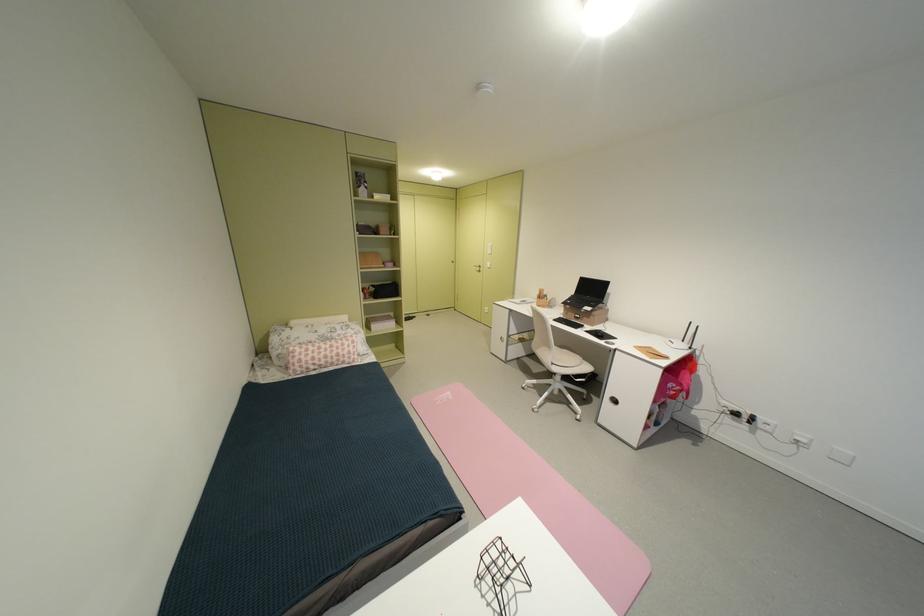
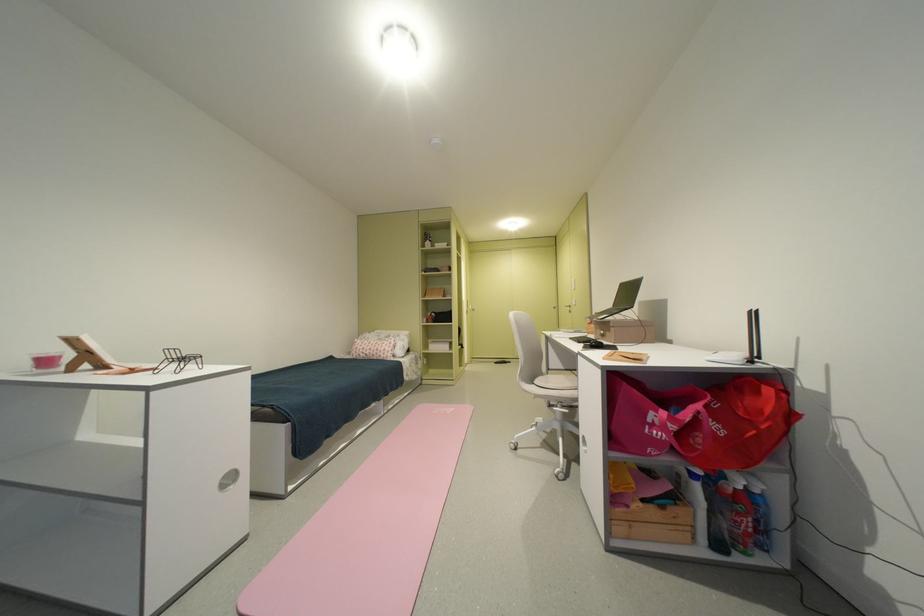
Find the pixel in the second image that matches the point at 598,318 in the first image.

(618, 331)